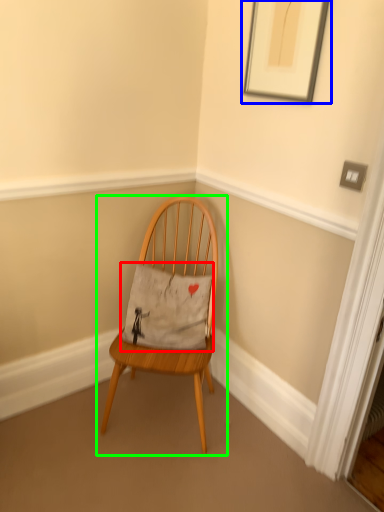
Question: Estimate the real-world distances between objects in this image. Which object is closer to pillow (highlighted by a red box), picture frame (highlighted by a blue box) or chair (highlighted by a green box)?

Choices:
 (A) picture frame
 (B) chair

Answer: (B)